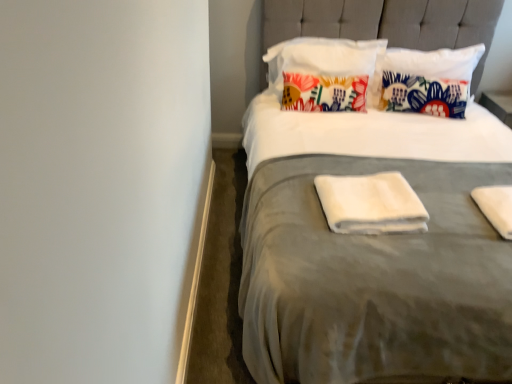
Question: Is white soft towel at center, the first material when ordered from left to right, in contact with white soft towel at right, the 2th material in the left-to-right sequence?

Choices:
 (A) no
 (B) yes

Answer: (A)

Question: From the image's perspective, is white soft towel at center, arranged as the second material when viewed from the right, over white soft towel at right, the 2th material in the left-to-right sequence?

Choices:
 (A) no
 (B) yes

Answer: (B)

Question: Considering the relative positions of white soft towel at center, arranged as the second material when viewed from the right, and white soft towel at right, the 1th material positioned from the right, in the image provided, is white soft towel at center, arranged as the second material when viewed from the right, to the right of white soft towel at right, the 1th material positioned from the right, from the viewer's perspective?

Choices:
 (A) no
 (B) yes

Answer: (A)

Question: Is white soft towel at center, the first material when ordered from left to right, positioned far away from white soft towel at right, the 2th material in the left-to-right sequence?

Choices:
 (A) yes
 (B) no

Answer: (B)

Question: Considering the relative sizes of white soft towel at center, the first material when ordered from left to right, and white soft towel at right, the 2th material in the left-to-right sequence, in the image provided, is white soft towel at center, the first material when ordered from left to right, smaller than white soft towel at right, the 2th material in the left-to-right sequence,?

Choices:
 (A) no
 (B) yes

Answer: (A)

Question: Could white soft towel at right, the 1th material positioned from the right, be considered to be inside white soft towel at center, the first material when ordered from left to right?

Choices:
 (A) yes
 (B) no

Answer: (B)

Question: Could you tell me if suede gray bed at center is facing floral fabric pillow at upper center, marked as the 1th pillow in a left-to-right arrangement?

Choices:
 (A) no
 (B) yes

Answer: (A)

Question: Is suede gray bed at center facing away from floral fabric pillow at upper center, marked as the 2th pillow in a right-to-left arrangement?

Choices:
 (A) yes
 (B) no

Answer: (A)

Question: Is suede gray bed at center at the left side of floral fabric pillow at upper center, marked as the 2th pillow in a right-to-left arrangement?

Choices:
 (A) no
 (B) yes

Answer: (A)

Question: Does suede gray bed at center have a lesser width compared to floral fabric pillow at upper center, marked as the 2th pillow in a right-to-left arrangement?

Choices:
 (A) yes
 (B) no

Answer: (B)

Question: From the image's perspective, would you say suede gray bed at center is positioned over floral fabric pillow at upper center, marked as the 2th pillow in a right-to-left arrangement?

Choices:
 (A) no
 (B) yes

Answer: (A)

Question: Can you confirm if suede gray bed at center is shorter than floral fabric pillow at upper center, marked as the 1th pillow in a left-to-right arrangement?

Choices:
 (A) no
 (B) yes

Answer: (A)

Question: From a real-world perspective, is white soft towel at right, the 1th material positioned from the right, positioned under suede gray bed at center based on gravity?

Choices:
 (A) yes
 (B) no

Answer: (A)